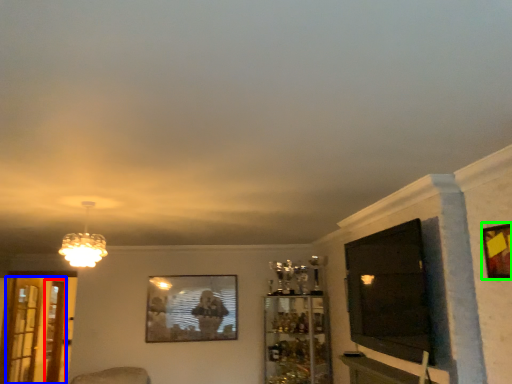
Question: Which object is positioned farthest from screen door (highlighted by a red box)? Select from screen door (highlighted by a blue box) and picture frame (highlighted by a green box).

Choices:
 (A) screen door
 (B) picture frame

Answer: (B)